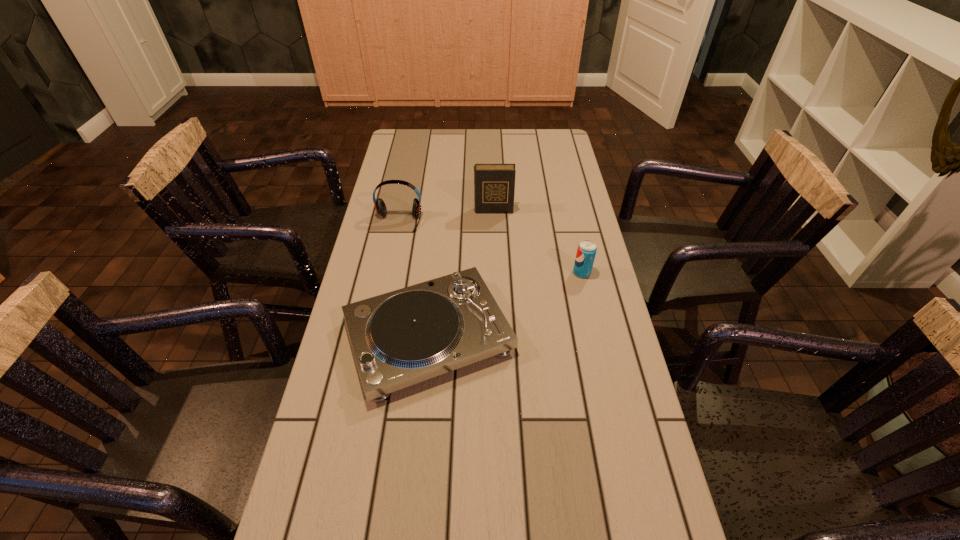
At what (x,y) coordinates should I click in order to perform the action: click on the tallest object. Please return your answer as a coordinate pair (x, y). Looking at the image, I should click on (494, 184).

Locate an element on the screen. the third shortest object is located at coordinates (380, 206).

The width and height of the screenshot is (960, 540). In order to click on soda can in this screenshot , I will do `click(586, 251)`.

Find the location of `the rightmost object`. the rightmost object is located at coordinates (586, 251).

I want to click on the nearest object, so click(400, 338).

Identify the location of the shortest object. (400, 338).

You are a GUI agent. You are given a task and a screenshot of the screen. Output one action in this format:
    pyautogui.click(x=<x>, y=<y>)
    Task: Click on the vacant space located on the front cover of the tallest object
    This screenshot has height=540, width=960.
    Given the screenshot: What is the action you would take?
    pyautogui.click(x=494, y=223)

Locate an element on the screen. free space located 0.140m with the microphone attached to the side of the second tallest object is located at coordinates (390, 262).

I want to click on vacant area situated 0.260m on the front of the second nearest object, so click(600, 353).

Identify the location of vacant space located on the front of the record player. This screenshot has height=540, width=960. (418, 444).